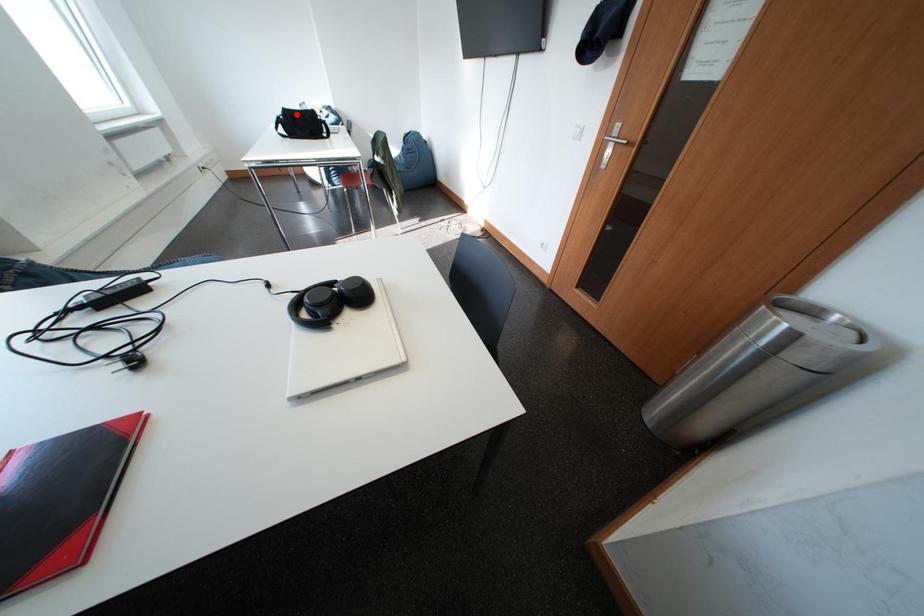
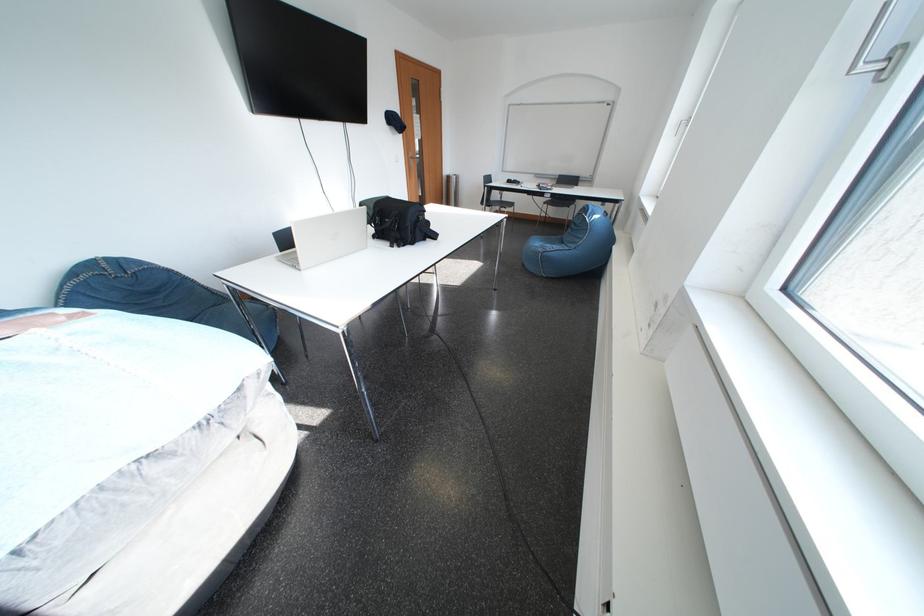
Question: I am providing you with two images of the same scene from different viewpoints. A red point is marked on the first image. Is the red point's position out of view in image 2?

Choices:
 (A) Yes
 (B) No

Answer: (A)